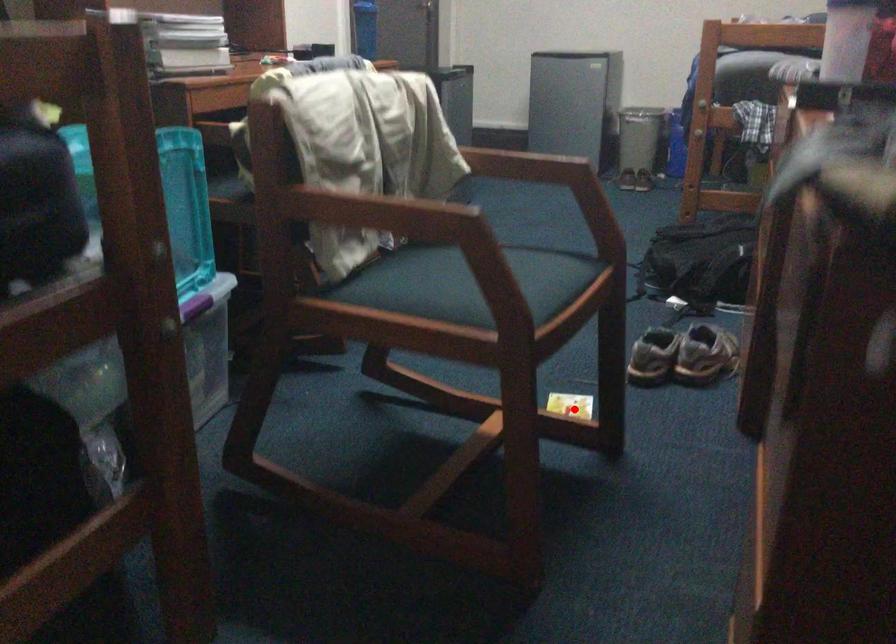
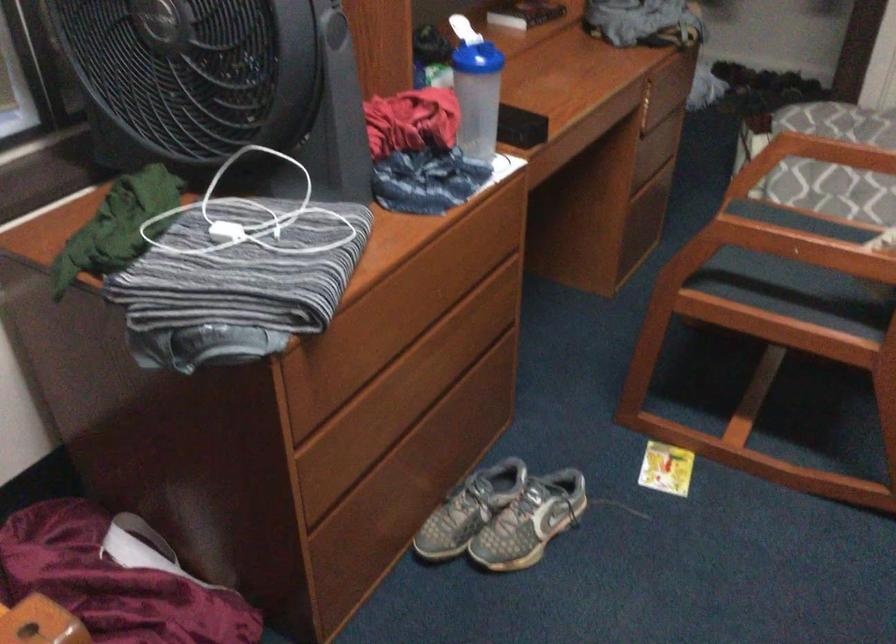
Locate, in the second image, the point that corresponds to the highlighted location in the first image.

(666, 468)